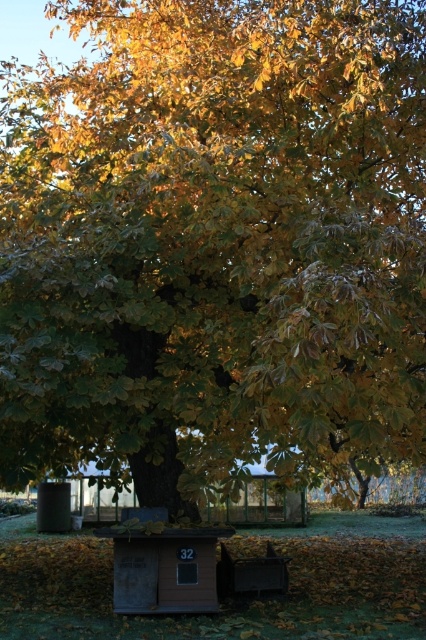
Question: Which point is closer to the camera?

Choices:
 (A) (129, 508)
 (B) (233, 579)

Answer: (A)

Question: Can you confirm if wooden hut at lower center is positioned above wooden bench at lower center?

Choices:
 (A) no
 (B) yes

Answer: (B)

Question: Can you confirm if wooden hut at lower center is positioned to the right of wooden bench at lower center?

Choices:
 (A) no
 (B) yes

Answer: (A)

Question: In this image, where is wooden hut at lower center located relative to wooden bench at lower center?

Choices:
 (A) left
 (B) right

Answer: (A)

Question: Which point is closer to the camera?

Choices:
 (A) (268, 589)
 (B) (158, 524)

Answer: (B)